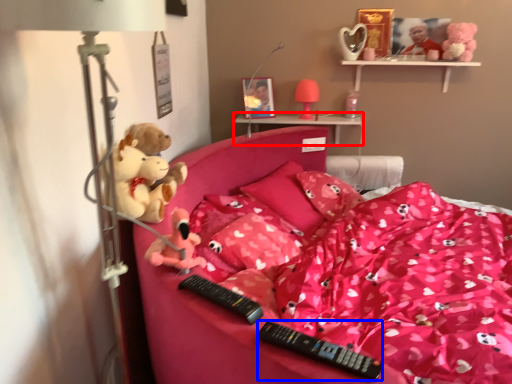
Question: Which of the following is the closest to the observer, shelf (highlighted by a red box) or remote (highlighted by a blue box)?

Choices:
 (A) shelf
 (B) remote

Answer: (B)